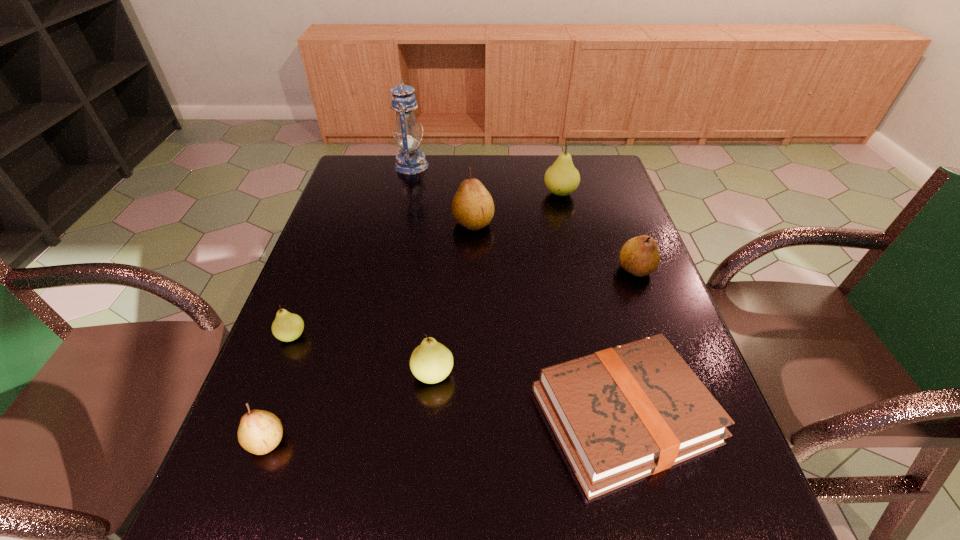
This screenshot has height=540, width=960. In order to click on free space that is in between the second pear from right to left and the leftmost green pear in this screenshot , I will do click(426, 265).

Image resolution: width=960 pixels, height=540 pixels. What are the coordinates of `vacant space that's between the hardback book and the second farthest pear` in the screenshot? It's located at (548, 319).

The width and height of the screenshot is (960, 540). I want to click on free space between the shortest object and the farthest pear, so click(591, 304).

Where is `vacant region between the smallest brown pear and the fifth farthest pear`? The width and height of the screenshot is (960, 540). vacant region between the smallest brown pear and the fifth farthest pear is located at coordinates (349, 408).

The image size is (960, 540). Identify the location of free space between the second brown pear from left to right and the rightmost pear. (554, 246).

Where is `the sixth closest object relative to the sixth object from right to left`? the sixth closest object relative to the sixth object from right to left is located at coordinates (621, 414).

Locate which object ranks third in proximity to the hardback book. Please provide its 2D coordinates. Your answer should be formatted as a tuple, i.e. [(x, y)], where the tuple contains the x and y coordinates of a point satisfying the conditions above.

[(472, 207)]

Locate an element on the screen. pear that stands as the second closest to the rightmost green pear is located at coordinates (640, 256).

This screenshot has width=960, height=540. I want to click on pear that is the fifth closest to the shortest object, so point(287,326).

Identify the location of green pear that is the closest one to the farthest object. (562, 178).